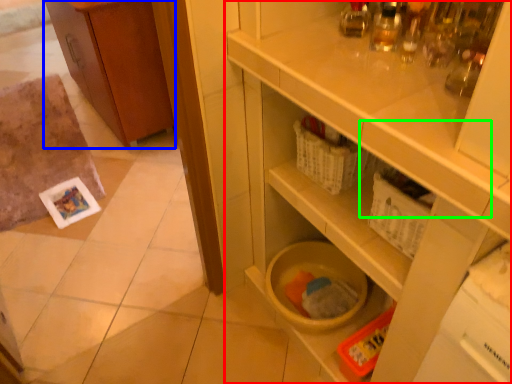
Question: Considering the real-world distances, which object is closest to cupboard (highlighted by a red box)? cabinetry (highlighted by a blue box) or drawer (highlighted by a green box).

Choices:
 (A) cabinetry
 (B) drawer

Answer: (B)